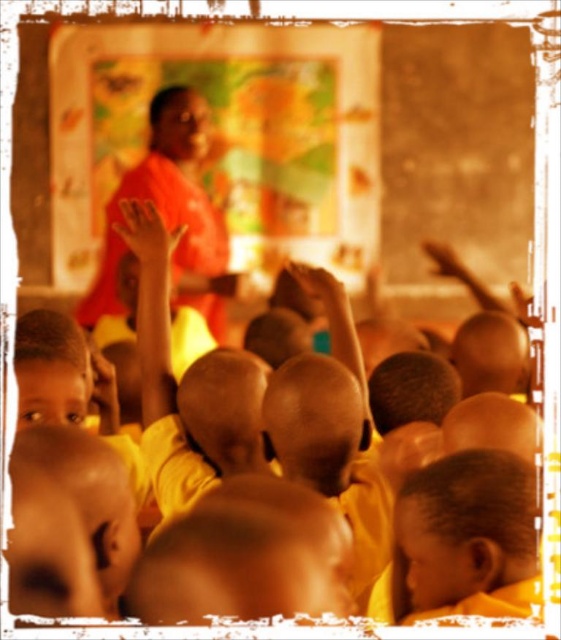
You are standing in the classroom and see the point at coordinates (x=466, y=529). What object is located at that point?

The smooth yellow shirt at lower right is located at point (x=466, y=529).